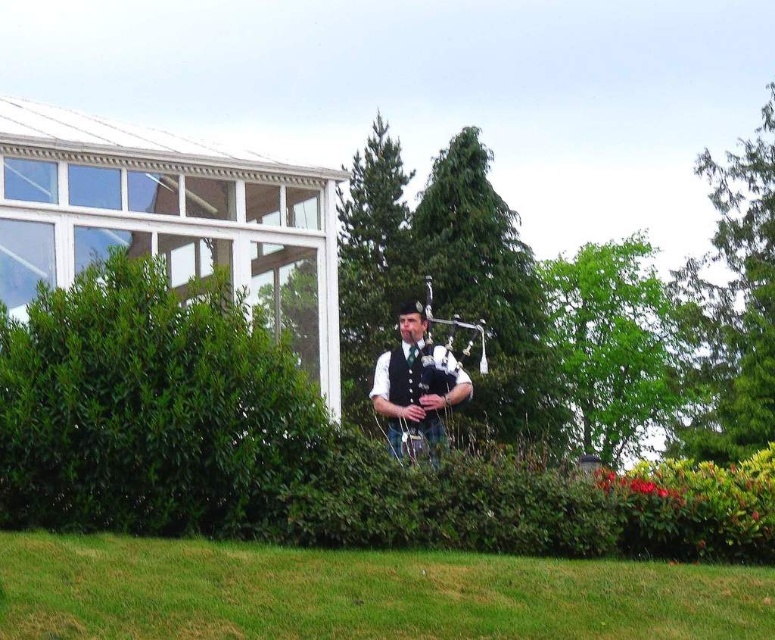
Question: Which object appears farthest from the camera in this image?

Choices:
 (A) matte black bagpipes at center
 (B) green grass at lower center

Answer: (A)

Question: Can you confirm if green leafy bush at center is smaller than matte black bagpipes at center?

Choices:
 (A) yes
 (B) no

Answer: (B)

Question: Is green leafy bush at center above matte black bagpipes at center?

Choices:
 (A) no
 (B) yes

Answer: (B)

Question: Can you confirm if green grass at lower center is positioned to the left of matte black bagpipes at center?

Choices:
 (A) no
 (B) yes

Answer: (B)

Question: Considering the real-world distances, which object is farthest from the green leafy bush at center?

Choices:
 (A) matte black bagpipes at center
 (B) green grass at lower center

Answer: (A)

Question: Which point appears farthest from the camera in this image?

Choices:
 (A) (424, 401)
 (B) (109, 461)

Answer: (A)